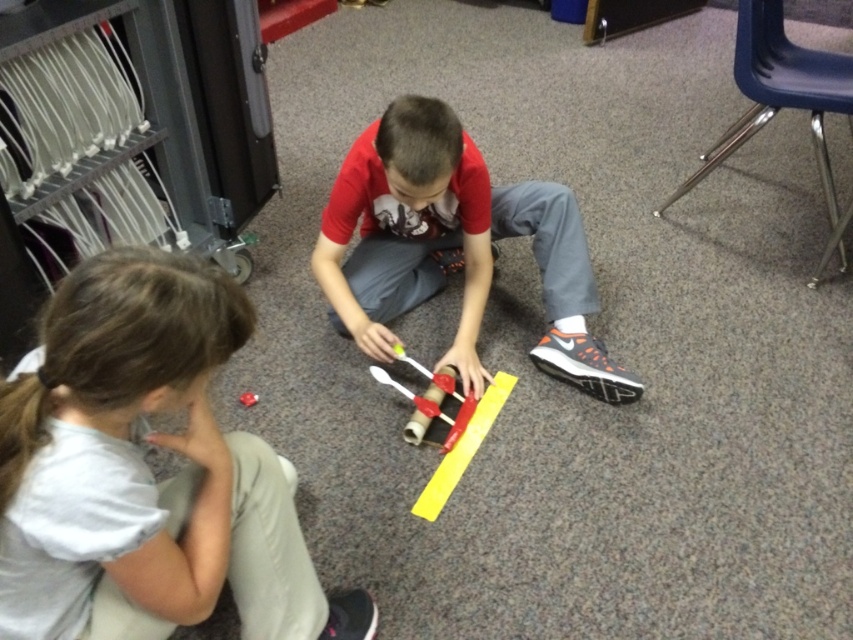
You are a teacher observing two children working on a craft project in the classroom. The children are wearing a white matte shirt at lower left and a matte red shirt at center. Which child is wearing a narrower shirt?

The white matte shirt at lower left has a lesser width compared to the matte red shirt at center, so the child wearing the white matte shirt at lower left has a narrower shirt.

You are standing in the classroom and want to pick up an object located at point (76, 417) and another object at point (605, 396). Which object will you reach first if you move towards them in the direction they are facing?

The object at point (76, 417) will be reached first because it is closer to the camera than the object at point (605, 396).

You are a teacher observing a craft activity in the classroom. You notice two children working on a project. The child wearing the white matte shirt at lower left and the child in the matte red shirt at center are sitting next to each other. Which child is positioned further to the left?

The white matte shirt at lower left is positioned further to the left compared to the matte red shirt at center as stated in the description.